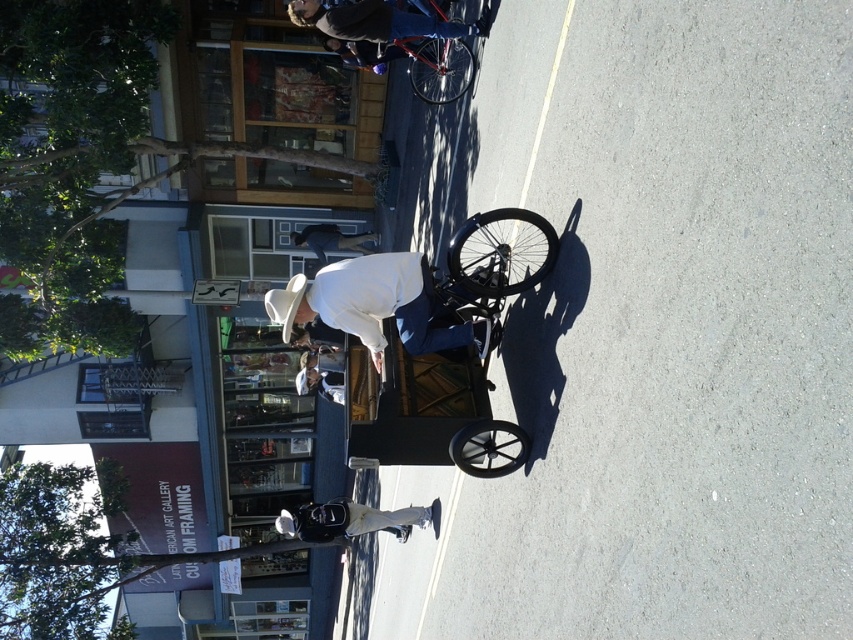
Question: Which point is closer to the camera taking this photo?

Choices:
 (A) (437, 22)
 (B) (422, 328)
 (C) (354, 237)
 (D) (332, 516)

Answer: (B)

Question: Which object appears closest to the camera in this image?

Choices:
 (A) white matte cowboy hat at lower center
 (B) dark blue jeans at center
 (C) metallic blue bicycle at upper center
 (D) white matte hat at upper center

Answer: (D)

Question: Can you confirm if white matte hat at upper center is bigger than dark blue jeans at center?

Choices:
 (A) no
 (B) yes

Answer: (B)

Question: Can you confirm if metallic blue bicycle at upper center is wider than dark blue jeans at center?

Choices:
 (A) yes
 (B) no

Answer: (A)

Question: Which object is closer to the camera taking this photo?

Choices:
 (A) white matte hat at upper center
 (B) dark blue jeans at center
 (C) shiny red bicycle at center

Answer: (A)

Question: Can you confirm if white matte hat at upper center is positioned below metallic blue bicycle at upper center?

Choices:
 (A) no
 (B) yes

Answer: (B)